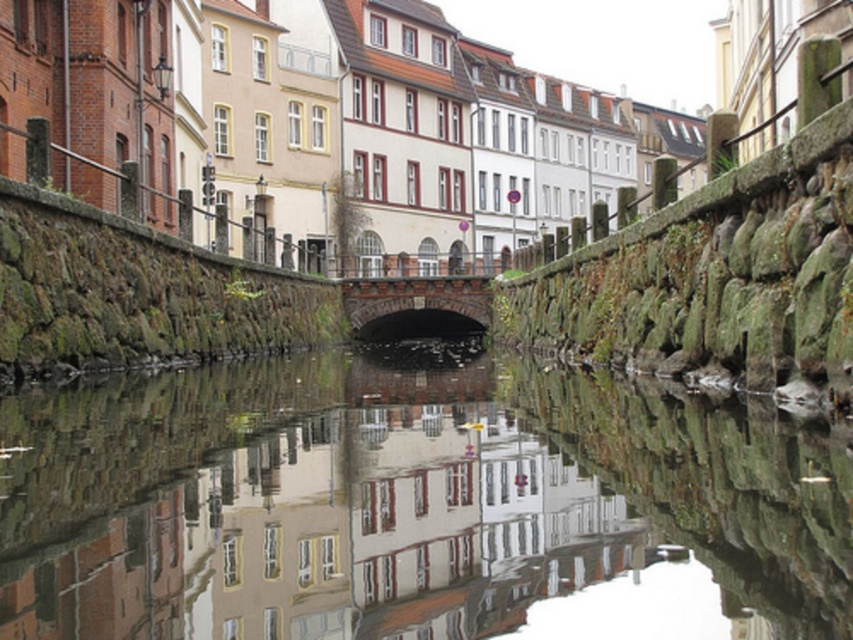
Question: Is the position of smooth reflective water at center less distant than that of dark brown stone bridge at center?

Choices:
 (A) yes
 (B) no

Answer: (A)

Question: Does smooth reflective water at center lie in front of dark brown stone bridge at center?

Choices:
 (A) no
 (B) yes

Answer: (B)

Question: Does smooth reflective water at center have a lesser width compared to dark brown stone bridge at center?

Choices:
 (A) yes
 (B) no

Answer: (B)

Question: Which point is farther from the camera taking this photo?

Choices:
 (A) (369, 292)
 (B) (358, 380)

Answer: (A)